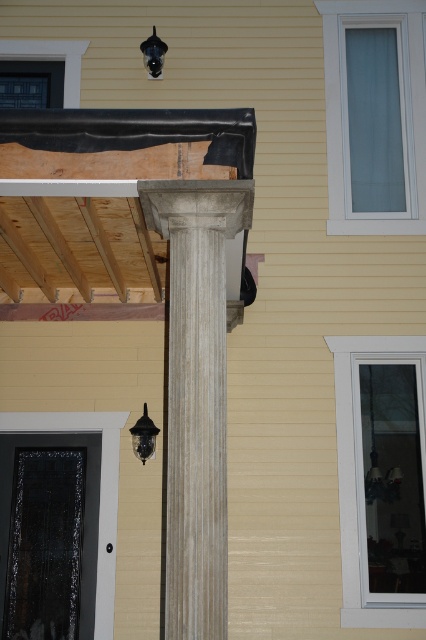
Question: Which point appears closest to the camera in this image?

Choices:
 (A) (152, 28)
 (B) (175, 544)

Answer: (B)

Question: Which object appears closest to the camera in this image?

Choices:
 (A) matte black lamp at lower left
 (B) gray stone column at center
 (C) metallic black lamp at upper center

Answer: (B)

Question: Does matte black lamp at lower left come behind metallic black lamp at upper center?

Choices:
 (A) yes
 (B) no

Answer: (B)

Question: Can you confirm if gray stone column at center is thinner than metallic black lamp at upper center?

Choices:
 (A) no
 (B) yes

Answer: (A)

Question: Does gray stone column at center have a smaller size compared to metallic black lamp at upper center?

Choices:
 (A) no
 (B) yes

Answer: (A)

Question: Which is nearer to the gray stone column at center?

Choices:
 (A) matte black lamp at lower left
 (B) metallic black lamp at upper center

Answer: (A)